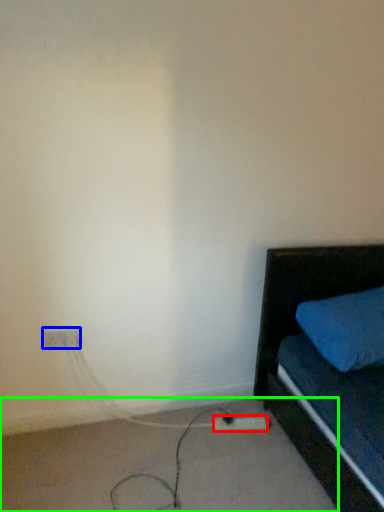
Question: Which object is the closest to the extension cord (highlighted by a red box)? Choose among these: electric outlet (highlighted by a blue box) or concrete (highlighted by a green box).

Choices:
 (A) electric outlet
 (B) concrete

Answer: (B)